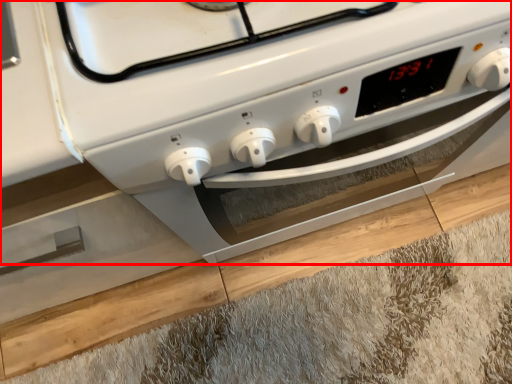
Question: From the image's perspective, what is the correct spatial positioning of home appliance (annotated by the red box) in reference to hardwood?

Choices:
 (A) below
 (B) above

Answer: (B)